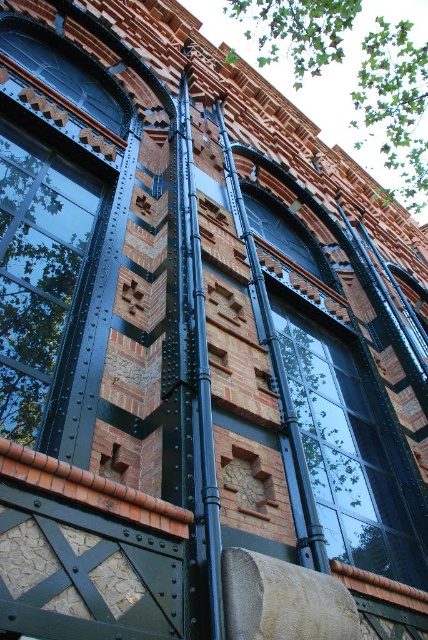
Does matte black window at left have a larger size compared to matte black glass window at center?

Yes.

Where is `matte black window at left`? matte black window at left is located at coordinates (56, 234).

Between matte black window at left and black metal pole at center, which one has less height?

With less height is matte black window at left.

Does point (83, 300) lie in front of point (202, 384)?

No, it is behind (202, 384).

Is point (14, 396) more distant than point (205, 340)?

No, (14, 396) is in front of (205, 340).

At what (x,y) coordinates should I click in order to perform the action: click on matte black window at left. Please return your answer as a coordinate pair (x, y). This screenshot has width=428, height=640. Looking at the image, I should click on (56, 234).

From the picture: Can you confirm if matte black glass window at center is smaller than black metal pole at center?

Incorrect, matte black glass window at center is not smaller in size than black metal pole at center.

This screenshot has height=640, width=428. Identify the location of matte black glass window at center. (348, 449).

At what (x,y) coordinates should I click in order to perform the action: click on matte black glass window at center. Please return your answer as a coordinate pair (x, y). This screenshot has width=428, height=640. Looking at the image, I should click on (348, 449).